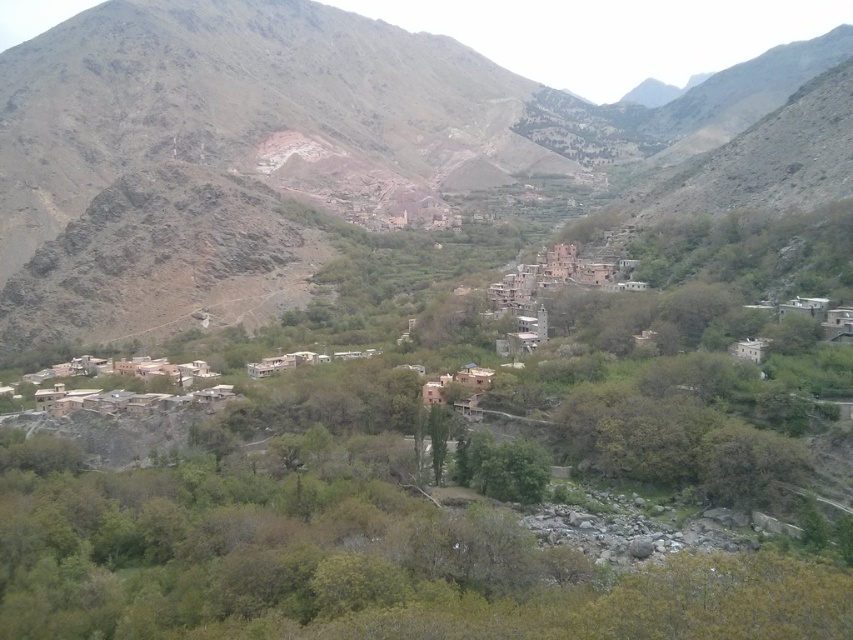
You are standing in the valley and want to climb the brown rocky mountain at center. If your hiking gear can handle slopes up to 150 meters in elevation, will you be able to reach the summit?

The distance between you and the brown rocky mountain at center is 174.91 meters, which exceeds your gear limit of 150 meters. Therefore, you cannot safely reach the summit with your current equipment.

You are standing at the point with coordinates point (279, 608) and want to walk to the point with coordinates point (469, 179). Is the destination point visible from your current position?

Point (469, 179) is behind point (279, 608), so the destination point is not visible from your current position.